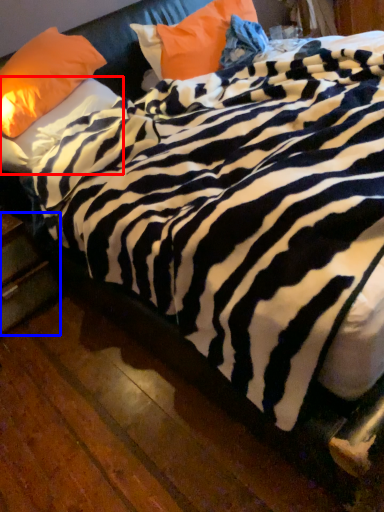
Question: Which object appears closest to the camera in this image, pillow (highlighted by a red box) or drawer (highlighted by a blue box)?

Choices:
 (A) pillow
 (B) drawer

Answer: (A)